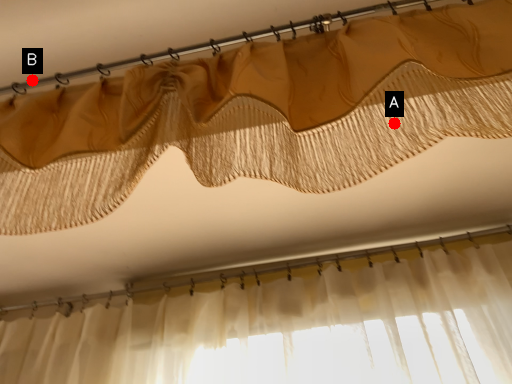
Question: Two points are circled on the image, labeled by A and B beside each circle. Among these points, which one is nearest to the camera?

Choices:
 (A) A is closer
 (B) B is closer

Answer: (A)